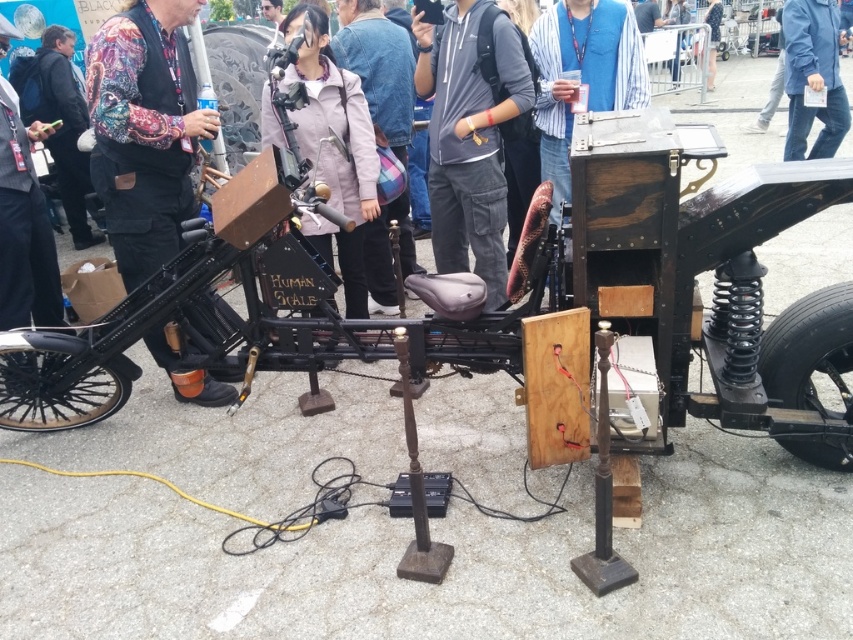
Is black leather jacket at left to the left of blue denim jacket at upper center from the viewer's perspective?

Indeed, black leather jacket at left is positioned on the left side of blue denim jacket at upper center.

Is point (54, 93) positioned behind point (714, 0)?

No, (54, 93) is closer to viewer.

Image resolution: width=853 pixels, height=640 pixels. I want to click on black leather jacket at left, so click(65, 125).

Does light purple fabric jacket at center appear over black leather jacket at left?

Incorrect, light purple fabric jacket at center is not positioned above black leather jacket at left.

Does light purple fabric jacket at center have a larger size compared to black leather jacket at left?

Correct, light purple fabric jacket at center is larger in size than black leather jacket at left.

Where is `light purple fabric jacket at center`? This screenshot has height=640, width=853. light purple fabric jacket at center is located at coordinates (378, 67).

Looking at this image, is patterned fabric shirt at center shorter than blue jeans at lower right?

No, patterned fabric shirt at center is not shorter than blue jeans at lower right.

Between point (161, 93) and point (788, 115), which one is positioned in front?

Positioned in front is point (161, 93).

Image resolution: width=853 pixels, height=640 pixels. Describe the element at coordinates (144, 131) in the screenshot. I see `patterned fabric shirt at center` at that location.

Locate an element on the screen. This screenshot has width=853, height=640. patterned fabric shirt at center is located at coordinates (144, 131).